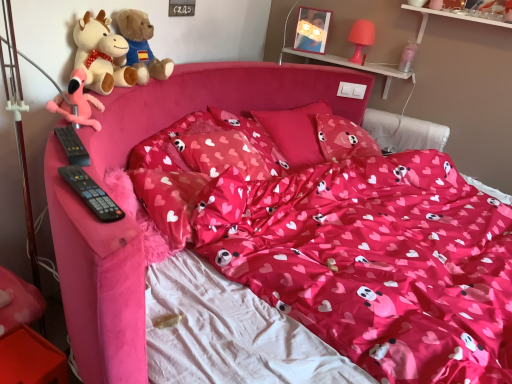
Question: Is shiny pink fabric at center behind clear plastic bottle at upper right, marked as the 2th toy in a left-to-right arrangement?

Choices:
 (A) yes
 (B) no

Answer: (B)

Question: Is shiny pink fabric at center outside clear plastic bottle at upper right, which is the 1th toy from back to front?

Choices:
 (A) no
 (B) yes

Answer: (B)

Question: Can you confirm if shiny pink fabric at center is positioned to the right of clear plastic bottle at upper right, which is the 1th toy from back to front?

Choices:
 (A) yes
 (B) no

Answer: (B)

Question: Does shiny pink fabric at center have a larger size compared to clear plastic bottle at upper right, the first toy when ordered from right to left?

Choices:
 (A) yes
 (B) no

Answer: (A)

Question: From the image's perspective, is shiny pink fabric at center on clear plastic bottle at upper right, the first toy positioned from the top?

Choices:
 (A) no
 (B) yes

Answer: (A)

Question: From a real-world perspective, is shiny pink fabric at center below clear plastic bottle at upper right, the first toy positioned from the top?

Choices:
 (A) no
 (B) yes

Answer: (B)

Question: Does shiny pink fabric at center lie in front of soft plush teddy bear at upper left, placed as the second teddy bear when sorted from front to back?

Choices:
 (A) no
 (B) yes

Answer: (B)

Question: From the image's perspective, is shiny pink fabric at center beneath soft plush teddy bear at upper left, the 1th teddy bear in the back-to-front sequence?

Choices:
 (A) no
 (B) yes

Answer: (B)

Question: From a real-world perspective, is shiny pink fabric at center over soft plush teddy bear at upper left, the 1th teddy bear in the back-to-front sequence?

Choices:
 (A) no
 (B) yes

Answer: (A)

Question: Is shiny pink fabric at center at the left side of soft plush teddy bear at upper left, the 1th teddy bear in the back-to-front sequence?

Choices:
 (A) yes
 (B) no

Answer: (B)

Question: Considering the relative sizes of shiny pink fabric at center and soft plush teddy bear at upper left, the 1th teddy bear in the back-to-front sequence, in the image provided, is shiny pink fabric at center taller than soft plush teddy bear at upper left, the 1th teddy bear in the back-to-front sequence,?

Choices:
 (A) yes
 (B) no

Answer: (A)

Question: Is shiny pink fabric at center wider than soft plush teddy bear at upper left, the 1th teddy bear in the back-to-front sequence?

Choices:
 (A) yes
 (B) no

Answer: (A)

Question: Is pink fabric pillow at center, which is the third pillow in front-to-back order, wider than matte pink pillow at center, the 3th pillow in the back-to-front sequence?

Choices:
 (A) no
 (B) yes

Answer: (B)